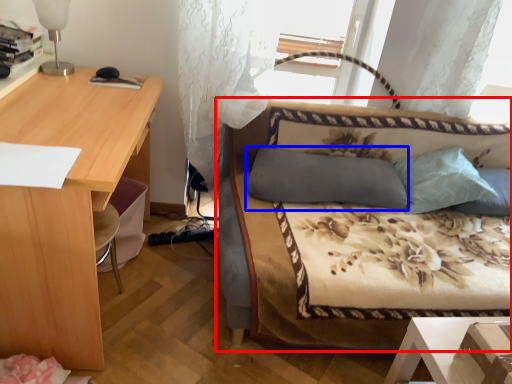
Question: Which of the following is the farthest to the observer, studio couch (highlighted by a red box) or pillow (highlighted by a blue box)?

Choices:
 (A) studio couch
 (B) pillow

Answer: (B)